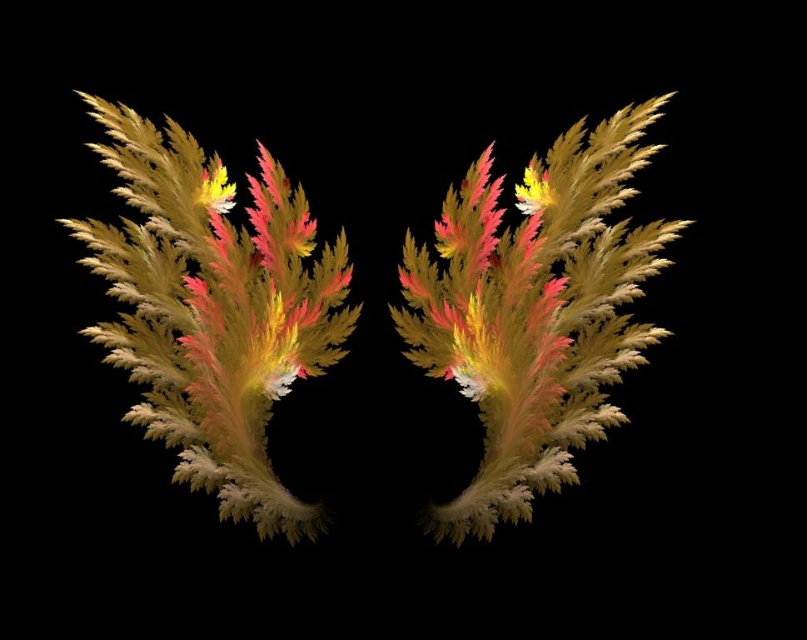
From the picture: Is multicolored frond at center closer to the viewer compared to velvety gold and pink flower at left?

No, multicolored frond at center is further to the viewer.

Between multicolored frond at center and velvety gold and pink flower at left, which one is positioned higher?

velvety gold and pink flower at left is above.

I want to click on multicolored frond at center, so click(534, 310).

Does shiny golden leaf at center have a larger size compared to multicolored frond at center?

Yes, shiny golden leaf at center is bigger than multicolored frond at center.

This screenshot has height=640, width=807. Identify the location of shiny golden leaf at center. (534, 310).

Where is `shiny golden leaf at center`? shiny golden leaf at center is located at coordinates [534, 310].

What are the coordinates of `shiny golden leaf at center` in the screenshot? It's located at (534, 310).

Is shiny golden leaf at center smaller than velvety gold and pink flower at left?

Actually, shiny golden leaf at center might be larger than velvety gold and pink flower at left.

Measure the distance between point (220, 304) and camera.

The distance of point (220, 304) from camera is 1.80 meters.

Where is `shiny golden leaf at center`? This screenshot has width=807, height=640. shiny golden leaf at center is located at coordinates (534, 310).